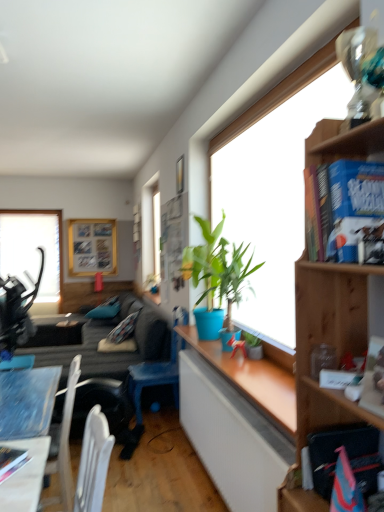
Question: Can you confirm if dark gray fabric couch at lower left is taller than blue hardcover book at upper right, which appears as the 2th book when viewed from the right?

Choices:
 (A) no
 (B) yes

Answer: (B)

Question: Does dark gray fabric couch at lower left touch blue hardcover book at upper right, which appears as the 2th book when viewed from the right?

Choices:
 (A) yes
 (B) no

Answer: (B)

Question: Would you say dark gray fabric couch at lower left contains blue hardcover book at upper right, which is the 1th book from front to back?

Choices:
 (A) yes
 (B) no

Answer: (B)

Question: Does dark gray fabric couch at lower left have a lesser width compared to blue hardcover book at upper right, which is the 1th book from front to back?

Choices:
 (A) yes
 (B) no

Answer: (B)

Question: From a real-world perspective, does dark gray fabric couch at lower left sit lower than blue hardcover book at upper right, which is the 1th book from front to back?

Choices:
 (A) yes
 (B) no

Answer: (A)

Question: Based on their sizes in the image, would you say blue hardcover book at upper right, which appears as the third book when ordered from the bottom, is bigger or smaller than green matte plant at window, the 2th houseplant when ordered from front to back?

Choices:
 (A) small
 (B) big

Answer: (B)

Question: From a real-world perspective, is blue hardcover book at upper right, which appears as the third book when ordered from the bottom, positioned above or below green matte plant at window, the 2th houseplant when ordered from front to back?

Choices:
 (A) above
 (B) below

Answer: (A)

Question: Looking at their shapes, would you say blue hardcover book at upper right, the third book from the back, is wider or thinner than green matte plant at window, which appears as the first houseplant when viewed from the back?

Choices:
 (A) thin
 (B) wide

Answer: (B)

Question: Is point (339, 254) positioned closer to the camera than point (246, 335)?

Choices:
 (A) farther
 (B) closer

Answer: (B)

Question: From a real-world perspective, is wooden desk at lower left above or below transparent glass window at upper left?

Choices:
 (A) above
 (B) below

Answer: (B)

Question: In the image, is wooden desk at lower left on the left side or the right side of transparent glass window at upper left?

Choices:
 (A) right
 (B) left

Answer: (A)

Question: From the image's perspective, is wooden desk at lower left above or below transparent glass window at upper left?

Choices:
 (A) below
 (B) above

Answer: (A)

Question: Do you think wooden desk at lower left is within transparent glass window at upper left, or outside of it?

Choices:
 (A) outside
 (B) inside

Answer: (A)

Question: Considering their positions, is dark gray fabric couch at lower left located in front of or behind wooden bookshelf at upper right?

Choices:
 (A) behind
 (B) front

Answer: (A)

Question: Is point (59, 315) positioned closer to the camera than point (324, 286)?

Choices:
 (A) closer
 (B) farther

Answer: (B)